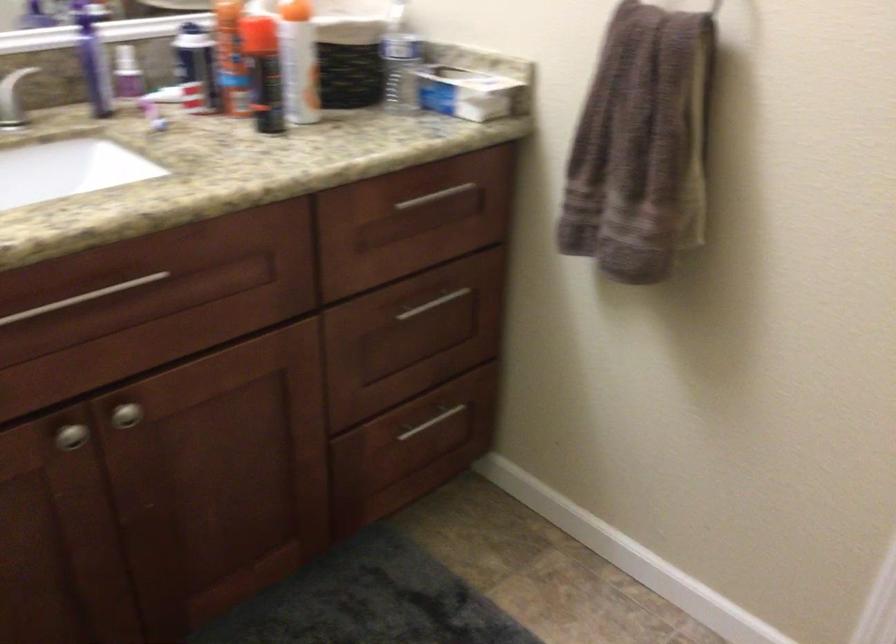
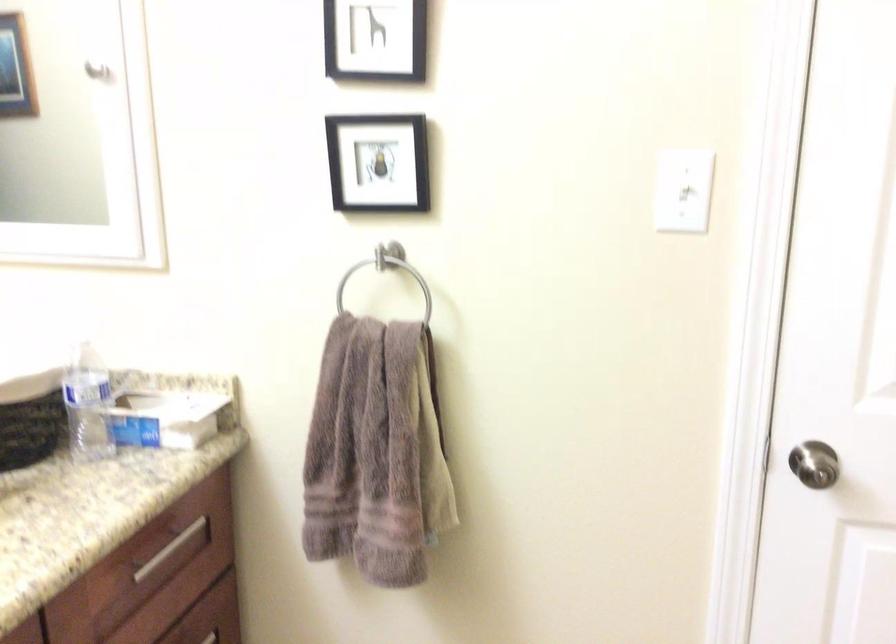
The point at (624,147) is marked in the first image. Where is the corresponding point in the second image?

(375, 453)